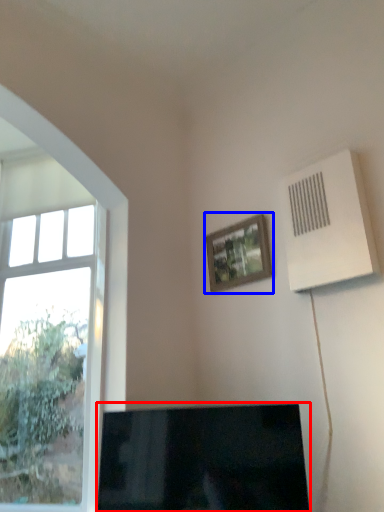
Question: Which of the following is the farthest to the observer, television (highlighted by a red box) or picture frame (highlighted by a blue box)?

Choices:
 (A) television
 (B) picture frame

Answer: (B)